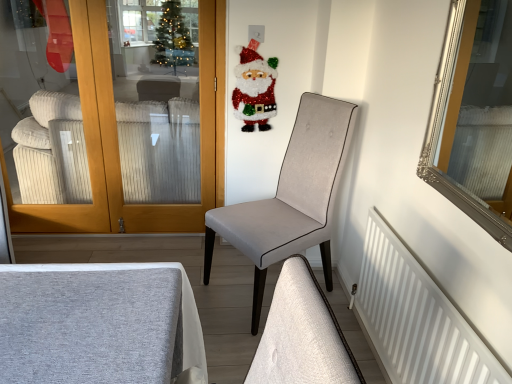
Locate an element on the screen. The width and height of the screenshot is (512, 384). blank space above white matte radiator at lower right (from a real-world perspective) is located at coordinates (412, 252).